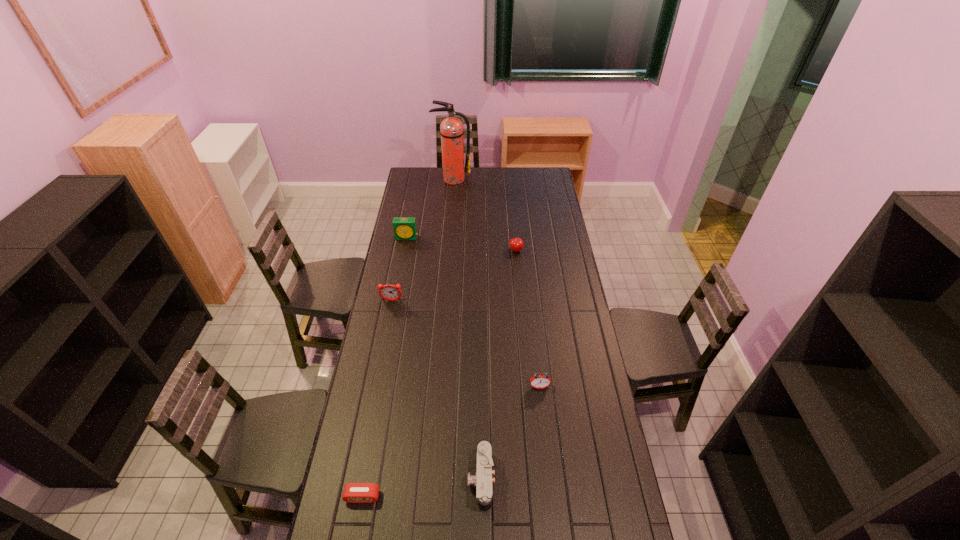
At what (x,y) coordinates should I click in order to perform the action: click on unoccupied position between the second farthest alarm clock and the camera. Please return your answer as a coordinate pair (x, y). Image resolution: width=960 pixels, height=540 pixels. Looking at the image, I should click on (437, 390).

This screenshot has width=960, height=540. I want to click on free area in between the cherry and the fourth farthest object, so click(454, 276).

You are a GUI agent. You are given a task and a screenshot of the screen. Output one action in this format:
    pyautogui.click(x=<x>, y=<y>)
    Task: Click on the vacant region between the third nearest object and the nearest alarm clock
    
    Given the screenshot: What is the action you would take?
    pyautogui.click(x=451, y=442)

Find the location of `vacant area between the fourth farthest object and the farthest object`. vacant area between the fourth farthest object and the farthest object is located at coordinates (422, 240).

Locate an element on the screen. object that stands as the closest to the fourth object from right to left is located at coordinates (404, 228).

Identify which object is located as the fourth nearest to the shortest alarm clock. Please provide its 2D coordinates. Your answer should be formatted as a tuple, i.e. [(x, y)], where the tuple contains the x and y coordinates of a point satisfying the conditions above.

[(516, 244)]

Locate which alarm clock ranks second in proximity to the cherry. Please provide its 2D coordinates. Your answer should be formatted as a tuple, i.e. [(x, y)], where the tuple contains the x and y coordinates of a point satisfying the conditions above.

[(388, 292)]

Locate which alarm clock is the third closest to the fifth farthest object. Please provide its 2D coordinates. Your answer should be formatted as a tuple, i.e. [(x, y)], where the tuple contains the x and y coordinates of a point satisfying the conditions above.

[(404, 228)]

Identify the location of vacant point that satisfies the following two spatial constraints: 1. on the lens of the camera; 2. on the front-facing side of the nearest alarm clock. click(481, 496).

Identify the location of blank area in the image that satisfies the following two spatial constraints: 1. on the front-facing side of the second farthest object; 2. on the left side of the fifth nearest object. (404, 251).